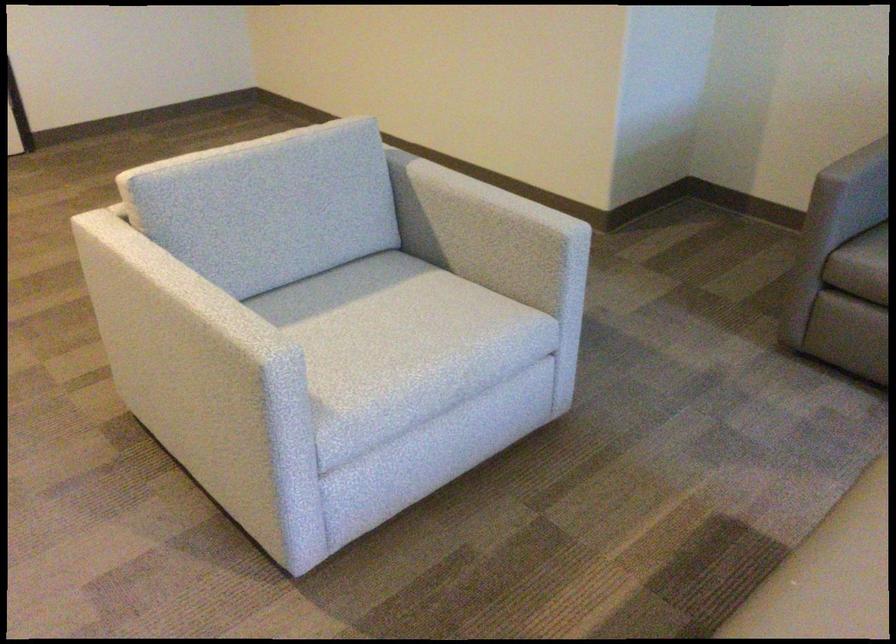
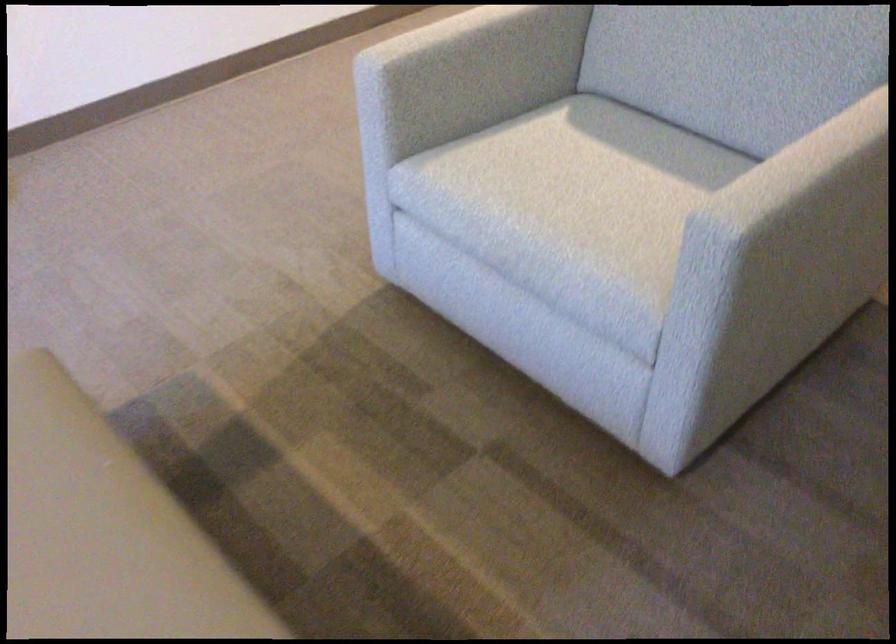
The point at (348, 316) is marked in the first image. Where is the corresponding point in the second image?

(607, 169)